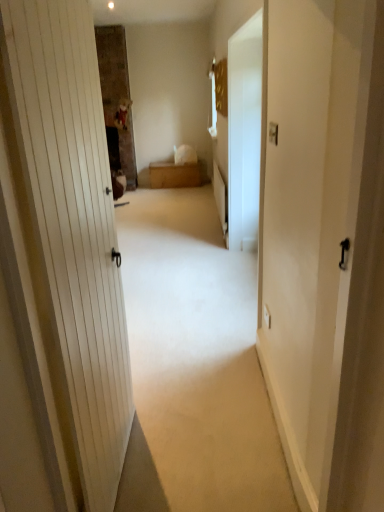
Where is `wooden chest at center`? wooden chest at center is located at coordinates (175, 175).

Where is `white matte door at center`? white matte door at center is located at coordinates (194, 364).

Is wooden chest at center facing towards white matte door at center?

Yes, wooden chest at center faces towards white matte door at center.

Is wooden chest at center far away from white matte door at center?

Yes, wooden chest at center and white matte door at center are quite far apart.

Is white matte door at center completely or partially inside wooden chest at center?

No, white matte door at center is not a part of wooden chest at center.

What's the angular difference between white matte door at center and wooden chest at center's facing directions?

2.29 degrees separate the facing orientations of white matte door at center and wooden chest at center.

From a real-world perspective, which object stands above the other?

wooden chest at center.

Is the depth of white matte door at center less than that of wooden chest at center?

Yes, it is in front of wooden chest at center.

Identify the location of plain lying on the right of wooden chest at center. (194, 364).

Would you consider wooden chest at center to be distant from white glossy screen door at center?

Absolutely, wooden chest at center is distant from white glossy screen door at center.

From a real-world perspective, is wooden chest at center physically located above or below white glossy screen door at center?

wooden chest at center is situated lower than white glossy screen door at center in the real world.

Could you tell me if wooden chest at center is facing white glossy screen door at center?

Yes, wooden chest at center is aimed at white glossy screen door at center.

Choose the correct answer: Is white glossy screen door at center inside wooden chest at center or outside it?

white glossy screen door at center is located beyond the bounds of wooden chest at center.

Which object is positioned more to the left, white glossy screen door at center or wooden chest at center?

wooden chest at center.

Is white glossy screen door at center smaller than wooden chest at center?

Correct, white glossy screen door at center occupies less space than wooden chest at center.

Between white glossy screen door at center and wooden chest at center, which one has less height?

Standing shorter between the two is wooden chest at center.

Is white glossy screen door at center surrounded by white matte door at center?

Actually, white glossy screen door at center is outside white matte door at center.

Between white matte door at center and white glossy screen door at center, which one has larger width?

white matte door at center is wider.

How far apart are white matte door at center and white glossy screen door at center?

white matte door at center and white glossy screen door at center are 1.08 meters apart.

Who is bigger, white matte door at center or white glossy screen door at center?

white matte door at center.

Looking at this image, is white glossy screen door at center positioned far away from white matte door at center?

Yes, white glossy screen door at center is far from white matte door at center.

The image size is (384, 512). What are the coordinates of `plain in front of the white glossy screen door at center` in the screenshot? It's located at (194, 364).

Is point (259, 16) farther from viewer compared to point (254, 378)?

No, it is in front of (254, 378).

Considering the sizes of objects white glossy screen door at center and white matte door at center in the image provided, who is thinner, white glossy screen door at center or white matte door at center?

white glossy screen door at center.

Where is `furniture located on the left of white matte door at center`? The image size is (384, 512). furniture located on the left of white matte door at center is located at coordinates (175, 175).

Find the location of a particular element. The width and height of the screenshot is (384, 512). plain that appears in front of the wooden chest at center is located at coordinates (x=194, y=364).

Which object lies nearer to the anchor point white matte door at center, white glossy screen door at center or wooden chest at center?

white glossy screen door at center is closer to white matte door at center.

Which object lies nearer to the anchor point white glossy screen door at center, white matte door at center or wooden chest at center?

white matte door at center is positioned closer to the anchor white glossy screen door at center.

Based on the photo, considering their positions, is white matte door at center positioned further to wooden chest at center than white glossy screen door at center?

Among the two, white matte door at center is located further to wooden chest at center.

Estimate the real-world distances between objects in this image. Which object is further from white glossy screen door at center, wooden chest at center or white matte door at center?

Based on the image, wooden chest at center appears to be further to white glossy screen door at center.

Which object lies further to the anchor point wooden chest at center, white glossy screen door at center or white matte door at center?

white matte door at center is further to wooden chest at center.

When comparing their distances from white matte door at center, does wooden chest at center or white glossy screen door at center seem further?

wooden chest at center is positioned further to the anchor white matte door at center.

This screenshot has width=384, height=512. I want to click on screen door between white matte door at center and wooden chest at center along the z-axis, so click(x=244, y=133).